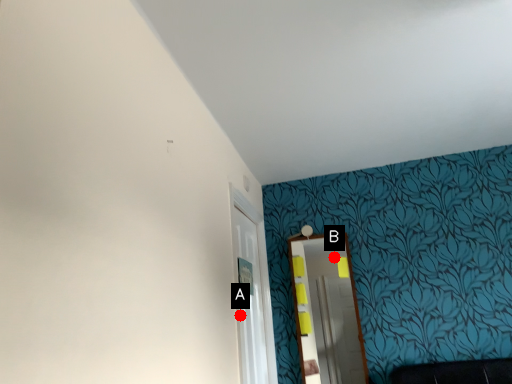
Question: Two points are circled on the image, labeled by A and B beside each circle. Which point is farther to the camera?

Choices:
 (A) A is further
 (B) B is further

Answer: (B)